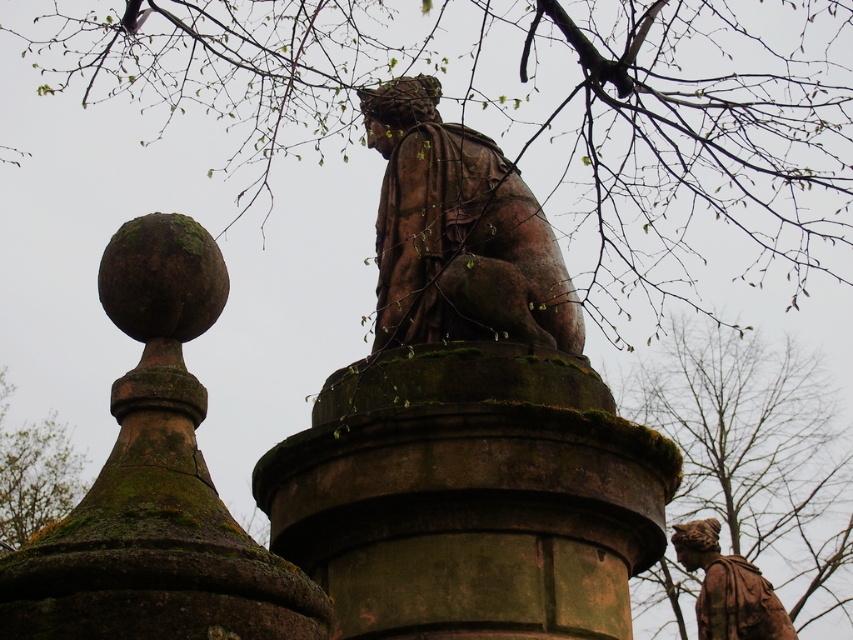
Question: Which is nearer to the green mossy tree at upper center?

Choices:
 (A) brown stone statue at lower right
 (B) green mossy tree at lower right
 (C) mossy stone finial at upper left

Answer: (B)

Question: Can you confirm if green mossy tree at upper center is thinner than green mossy stone at upper left?

Choices:
 (A) yes
 (B) no

Answer: (B)

Question: Is rustic stone statue at center in front of brown stone statue at lower right?

Choices:
 (A) yes
 (B) no

Answer: (A)

Question: Which object is positioned closest to the brown stone statue at lower right?

Choices:
 (A) mossy stone finial at upper left
 (B) green mossy stone at upper left
 (C) green mossy tree at lower right
 (D) rustic stone statue at center

Answer: (D)

Question: Can you confirm if rustic stone statue at center is thinner than brown stone statue at lower right?

Choices:
 (A) yes
 (B) no

Answer: (B)

Question: Which point is farther to the camera?

Choices:
 (A) (521, 88)
 (B) (683, 396)

Answer: (B)